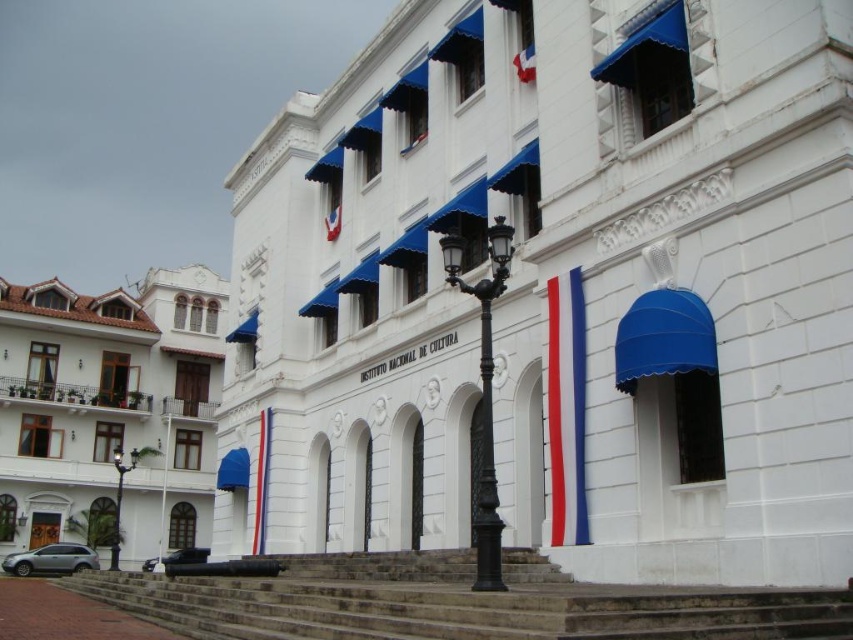
Question: Which object appears closest to the camera in this image?

Choices:
 (A) metallic pole at left
 (B) brown stone stairs at lower left

Answer: (B)

Question: Which object is the farthest from the blue fabric flag at lower left?

Choices:
 (A) white fabric flag at upper center
 (B) metallic pole at left
 (C) red fabric flag at center

Answer: (B)

Question: In this image, where is white stucco building at left located relative to white fabric flag at upper center?

Choices:
 (A) below
 (B) above

Answer: (A)

Question: Considering the real-world distances, which object is closest to the brown stone stairs at lower left?

Choices:
 (A) white stone building at center
 (B) black wrought iron streetlight at center

Answer: (B)

Question: Is blue fabric flag at lower left closer to the viewer compared to metallic pole at left?

Choices:
 (A) no
 (B) yes

Answer: (B)

Question: Can you confirm if black wrought iron pole at center is positioned below blue fabric flag at lower left?

Choices:
 (A) yes
 (B) no

Answer: (B)